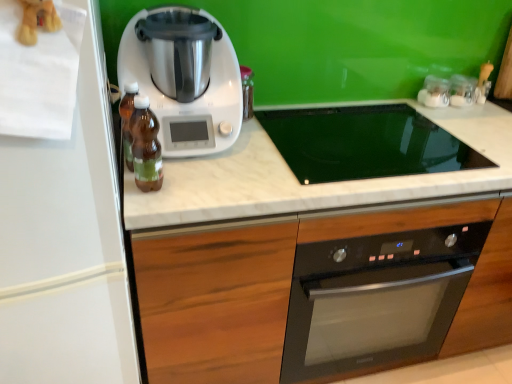
Locate an element on the screen. The image size is (512, 384). vacant area to the right of brown glass bottle at left, which is the 1th bottle in back-to-front order is located at coordinates (204, 178).